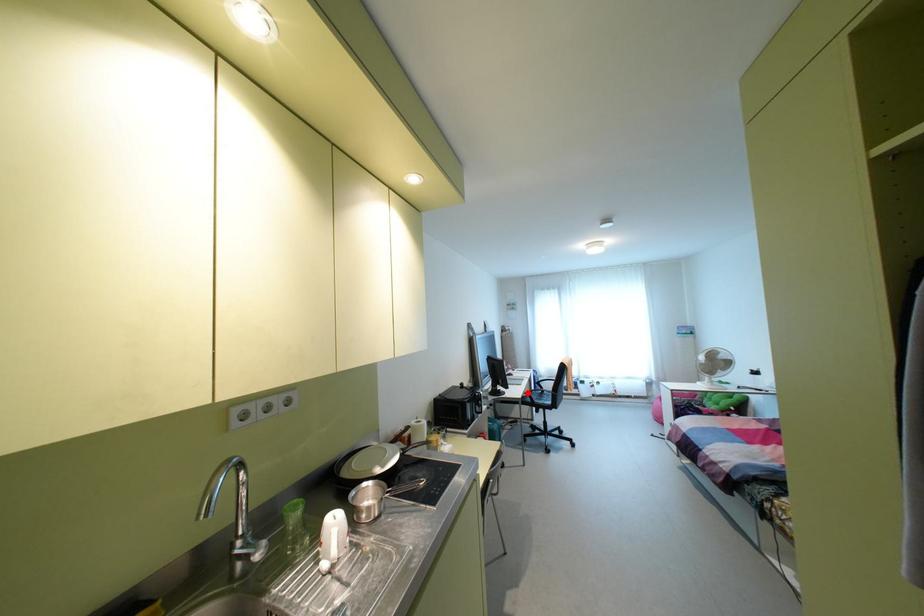
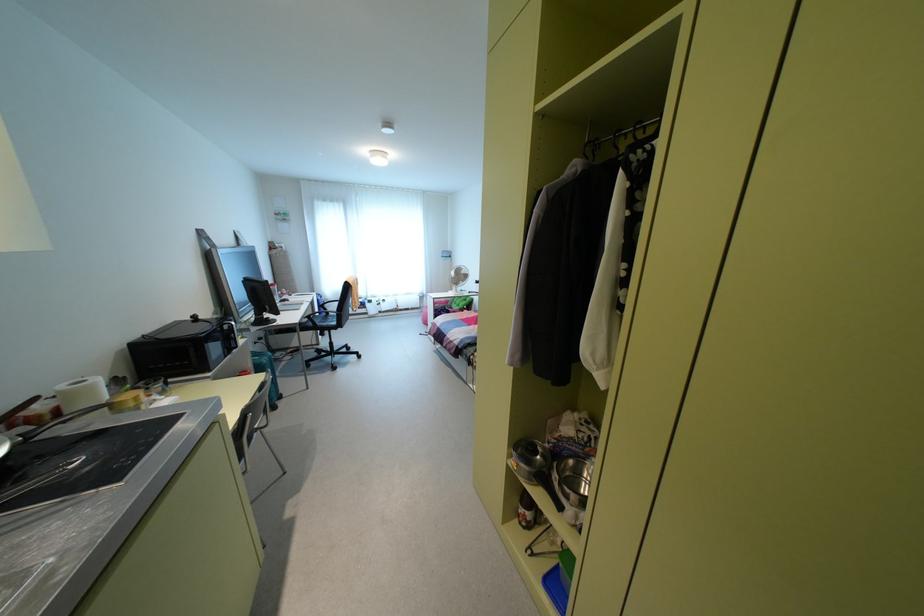
The point at the highlighted location is marked in the first image. Where is the corresponding point in the second image?

(309, 315)